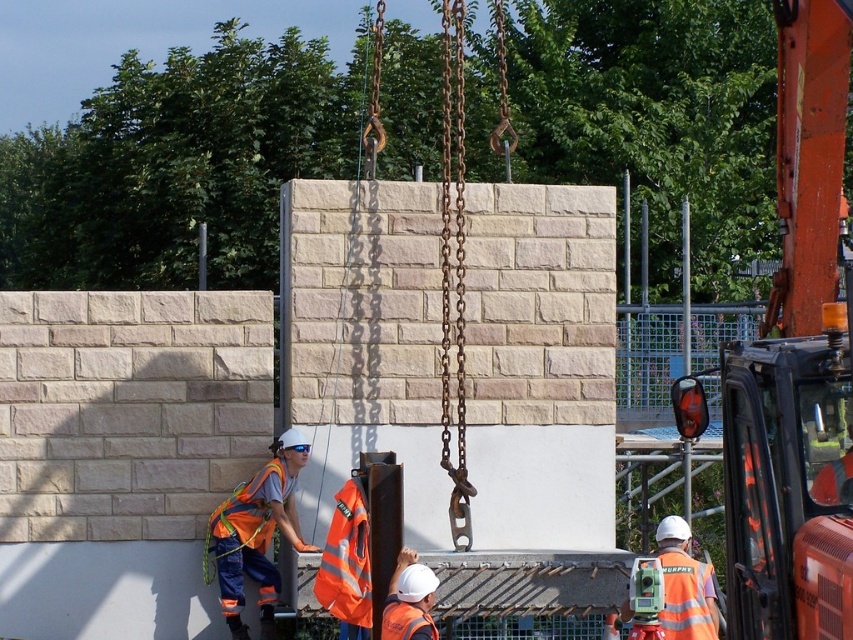
Question: Which point is farther to the camera?

Choices:
 (A) reflective orange vest at center
 (B) reflective orange safety vest at center
 (C) orange reflective safety vest at lower left

Answer: (C)

Question: Does reflective orange safety vest at center have a greater width compared to orange reflective safety vest at lower left?

Choices:
 (A) yes
 (B) no

Answer: (A)

Question: Which object is positioned closest to the reflective orange safety vest at center?

Choices:
 (A) orange reflective safety vest at lower left
 (B) reflective orange vest at center

Answer: (A)

Question: Which object appears farthest from the camera in this image?

Choices:
 (A) orange reflective safety vest at lower left
 (B) reflective orange vest at center

Answer: (A)

Question: Is reflective orange safety vest at center closer to the viewer compared to orange reflective safety vest at lower left?

Choices:
 (A) yes
 (B) no

Answer: (A)

Question: Does reflective orange safety vest at center appear on the left side of orange reflective safety vest at lower left?

Choices:
 (A) no
 (B) yes

Answer: (A)